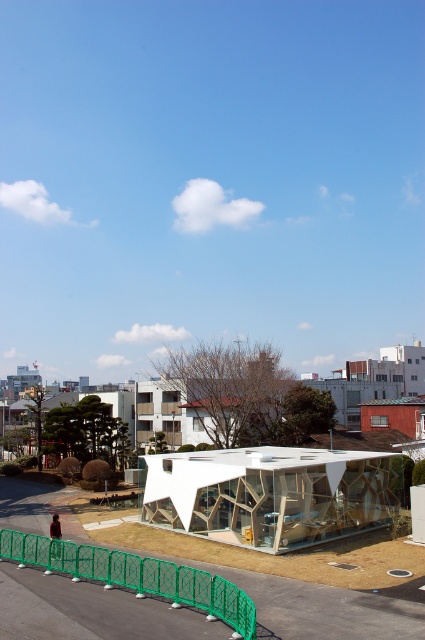
Looking at this image, which is below, transparent glass shelter at center or green plastic fence at lower center?

transparent glass shelter at center is lower down.

Is point (224, 486) positioned after point (5, 554)?

Yes, point (224, 486) is behind point (5, 554).

This screenshot has width=425, height=640. I want to click on transparent glass shelter at center, so (271, 493).